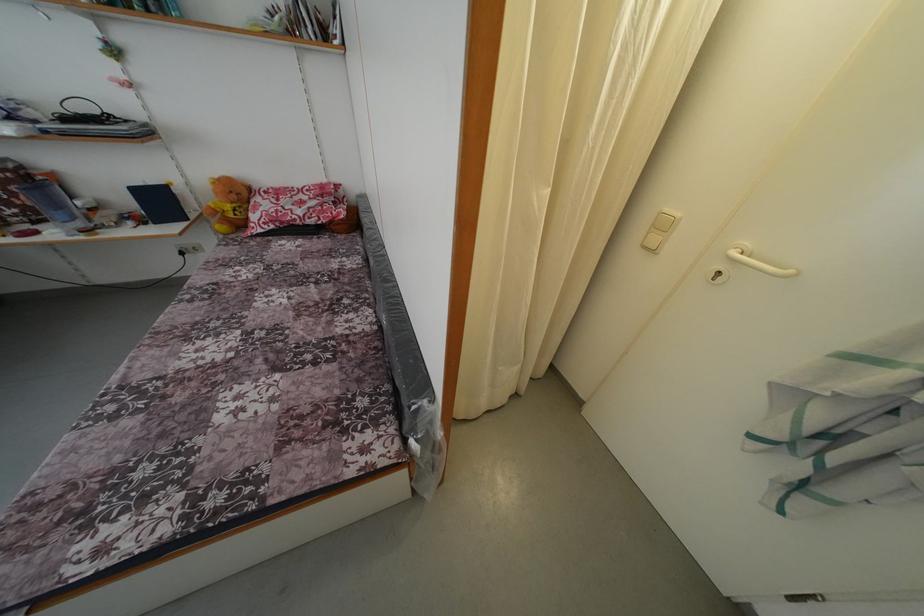
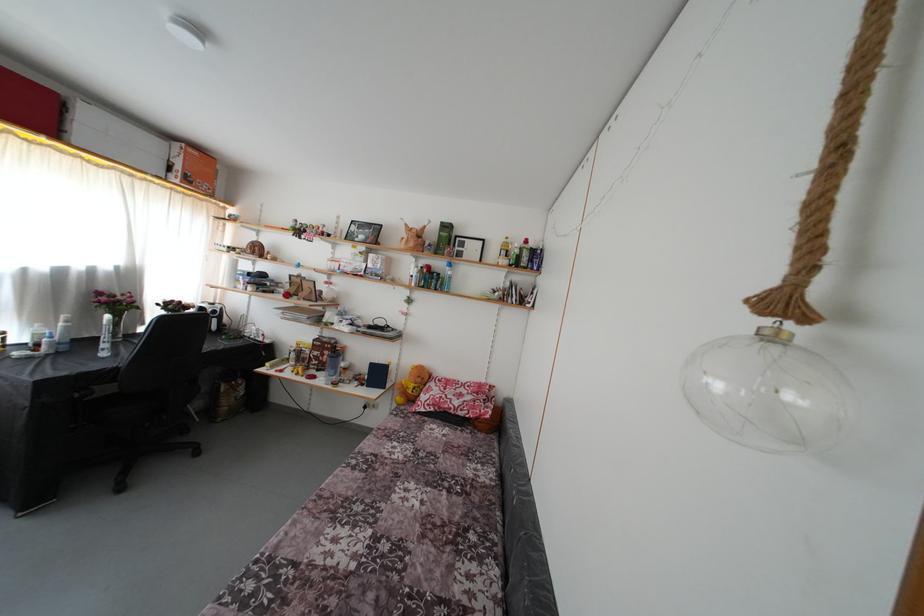
The first image is from the beginning of the video and the second image is from the end. How did the camera likely rotate when shooting the video?

The camera's rotation is toward left-up.